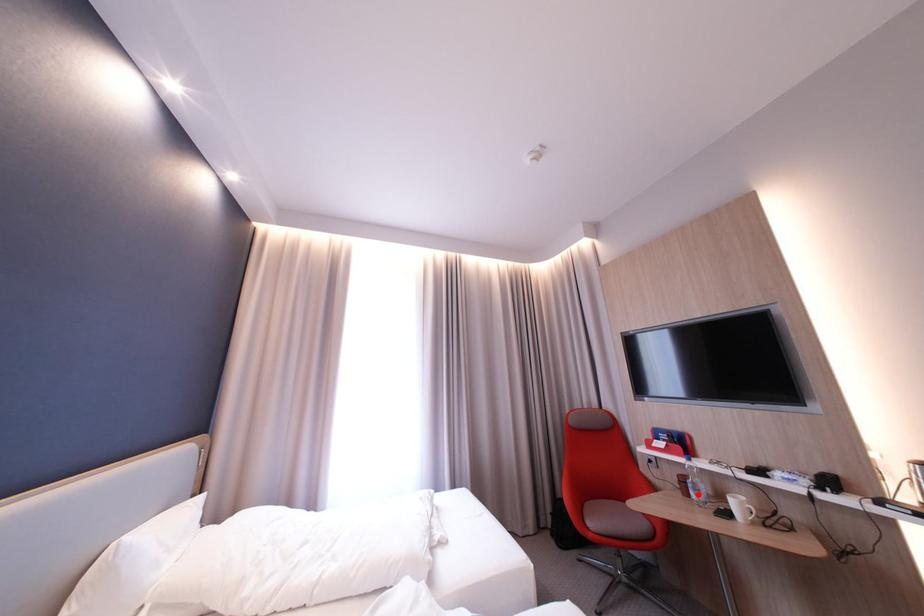
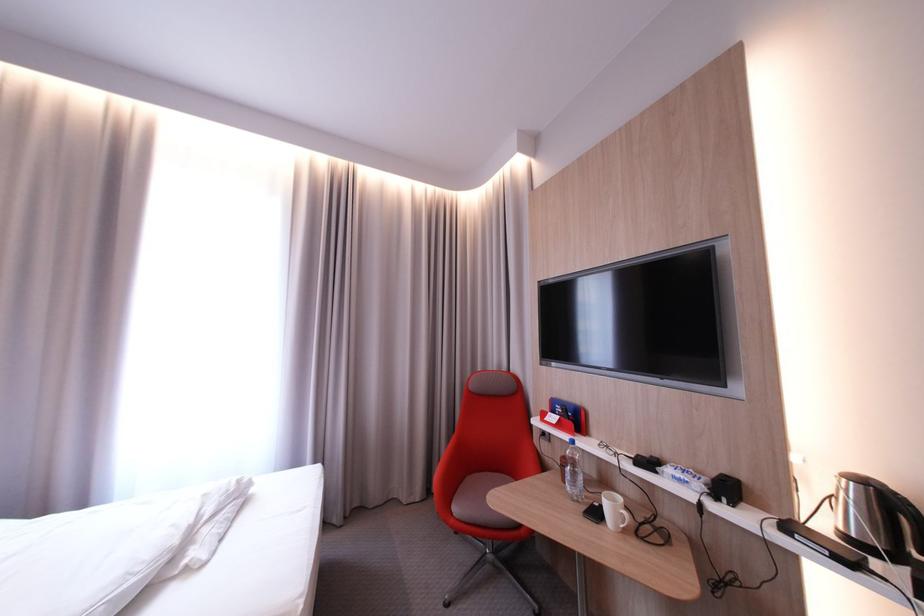
Locate, in the second image, the point that corresponds to the highlighted location in the first image.

(576, 482)